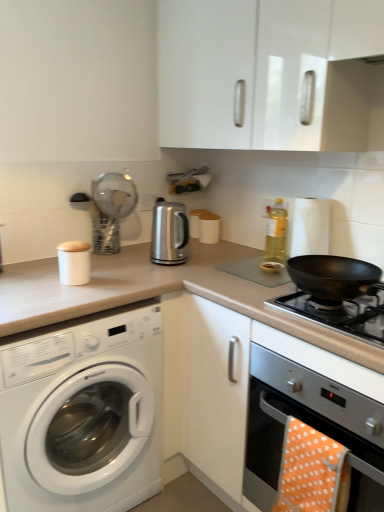
At what (x,y) coordinates should I click in order to perform the action: click on vacant space to the right of metal mesh strainer at upper center, the 2th appliance in the left-to-right sequence. Please return your answer as a coordinate pair (x, y). Image resolution: width=384 pixels, height=512 pixels. Looking at the image, I should click on (147, 256).